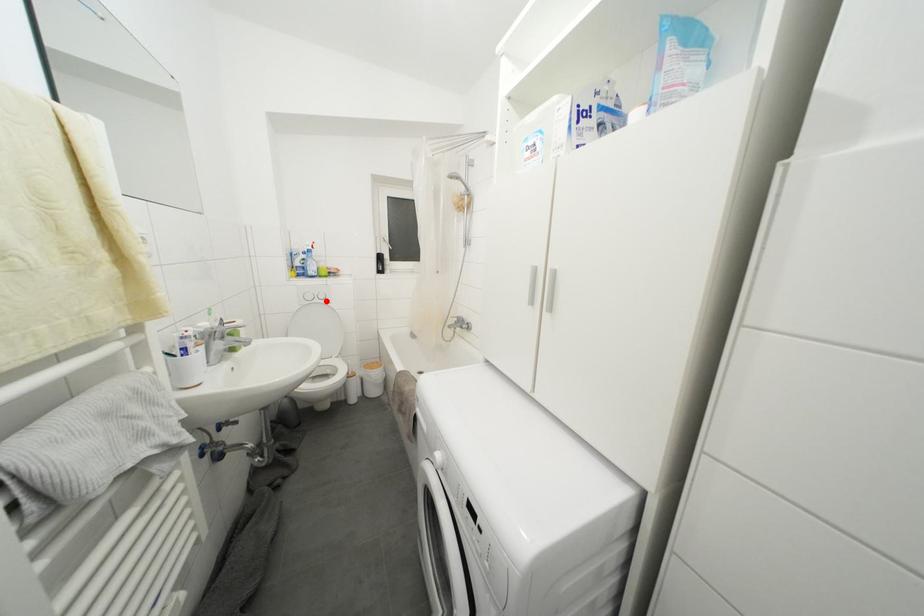
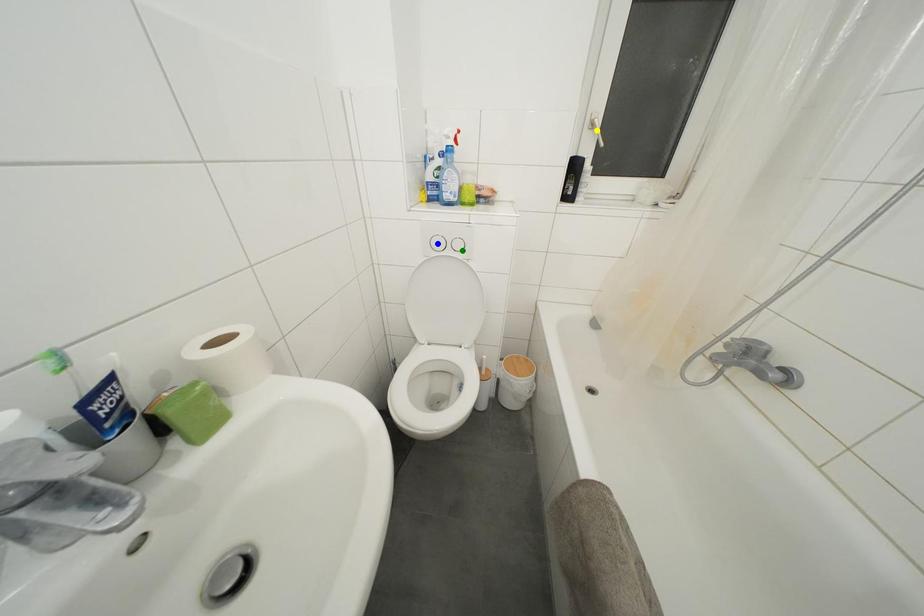
Question: I am providing you with two images of the same scene from different viewpoints. A red point is marked on the first image. You are given multiple points on the second image. Which point in image 2 represents the same 3d spot as the red point in image 1?

Choices:
 (A) blue point
 (B) yellow point
 (C) green point

Answer: (C)